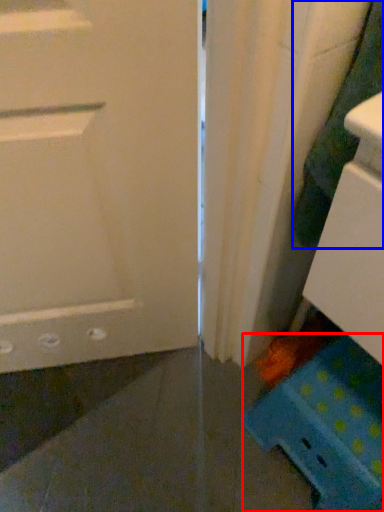
Question: Which object is closer to the camera taking this photo, cabinetry (highlighted by a red box) or laundry (highlighted by a blue box)?

Choices:
 (A) cabinetry
 (B) laundry

Answer: (B)